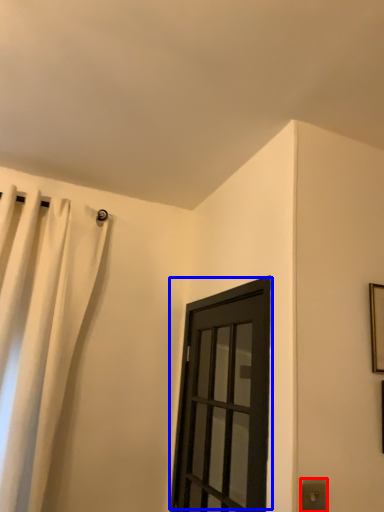
Question: Which of the following is the closest to the observer, electric outlet (highlighted by a red box) or door (highlighted by a blue box)?

Choices:
 (A) electric outlet
 (B) door

Answer: (A)